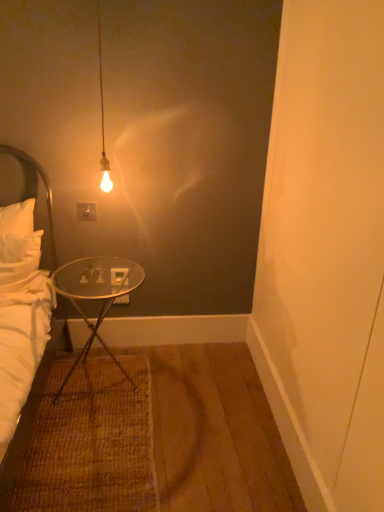
Identify the location of free space in front of transparent glass table at lower left. This screenshot has height=512, width=384. click(89, 441).